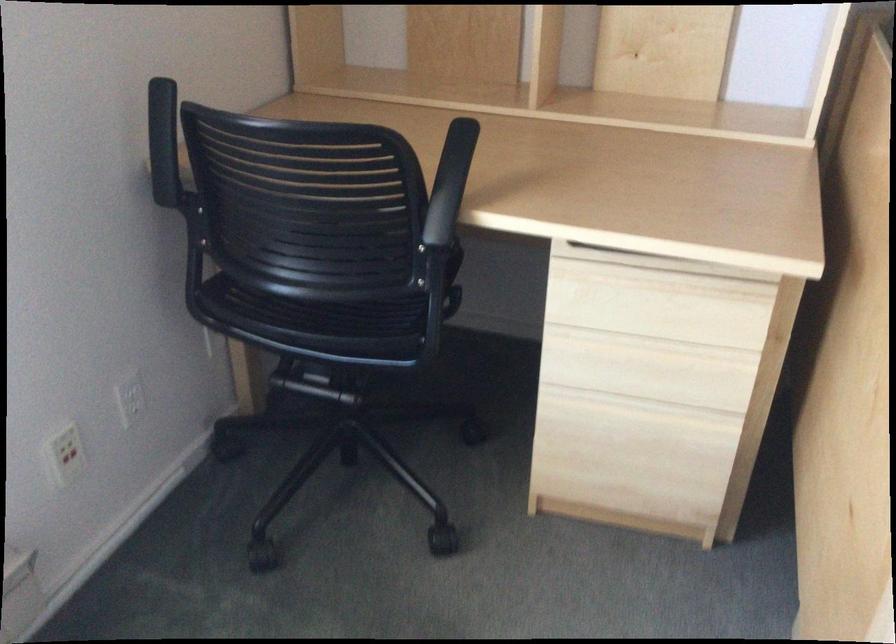
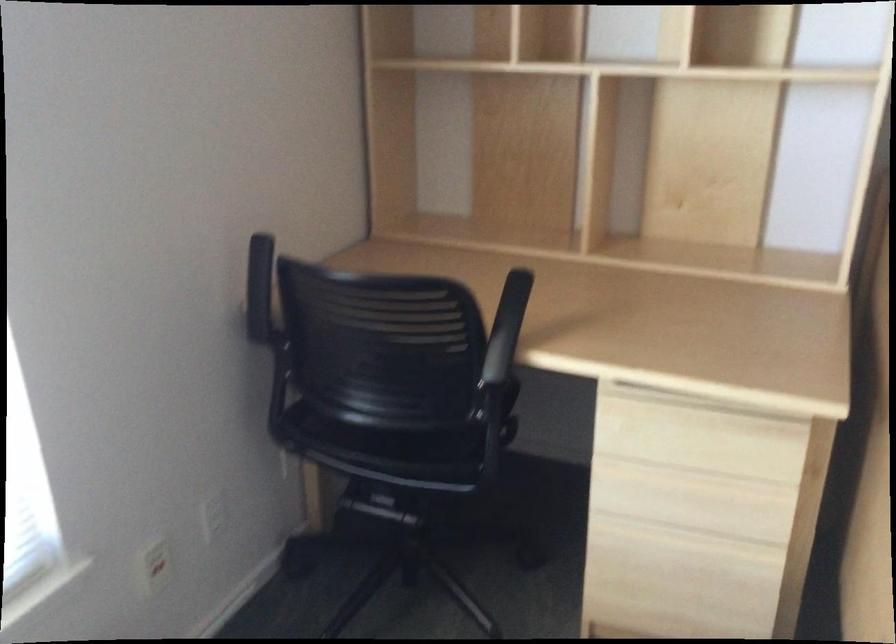
Question: Which direction would the cameraman need to move to produce the second image? Reply with the corresponding letter.

Choices:
 (A) Left
 (B) Right
 (C) Forward
 (D) Backward

Answer: (D)